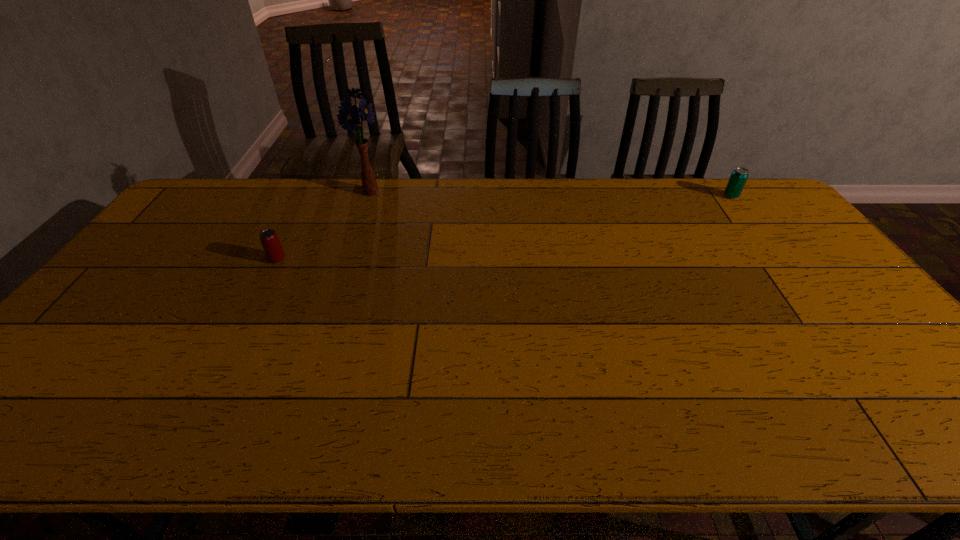
Where is `beer can at the far edge`? This screenshot has width=960, height=540. beer can at the far edge is located at coordinates (738, 178).

Where is `object that is at the right edge`? object that is at the right edge is located at coordinates (738, 178).

Locate an element on the screen. object situated at the far right corner is located at coordinates (738, 178).

In the image, there is a desktop. Identify the location of free space at the far edge. The image size is (960, 540). (327, 195).

This screenshot has height=540, width=960. What are the coordinates of `vacant region at the near edge` in the screenshot? It's located at (357, 409).

The width and height of the screenshot is (960, 540). What are the coordinates of `vacant space at the left edge of the desktop` in the screenshot? It's located at (151, 239).

You are a GUI agent. You are given a task and a screenshot of the screen. Output one action in this format:
    pyautogui.click(x=<x>, y=<y>)
    Task: Click on the vacant region at the right edge of the desktop
    This screenshot has width=960, height=540.
    Given the screenshot: What is the action you would take?
    pyautogui.click(x=840, y=313)

I want to click on free space at the near right corner, so click(x=923, y=433).

In order to click on vacant region between the left beer can and the right beer can in this screenshot , I will do `click(504, 227)`.

Locate an element on the screen. blank region between the leftmost object and the rightmost object is located at coordinates (504, 227).